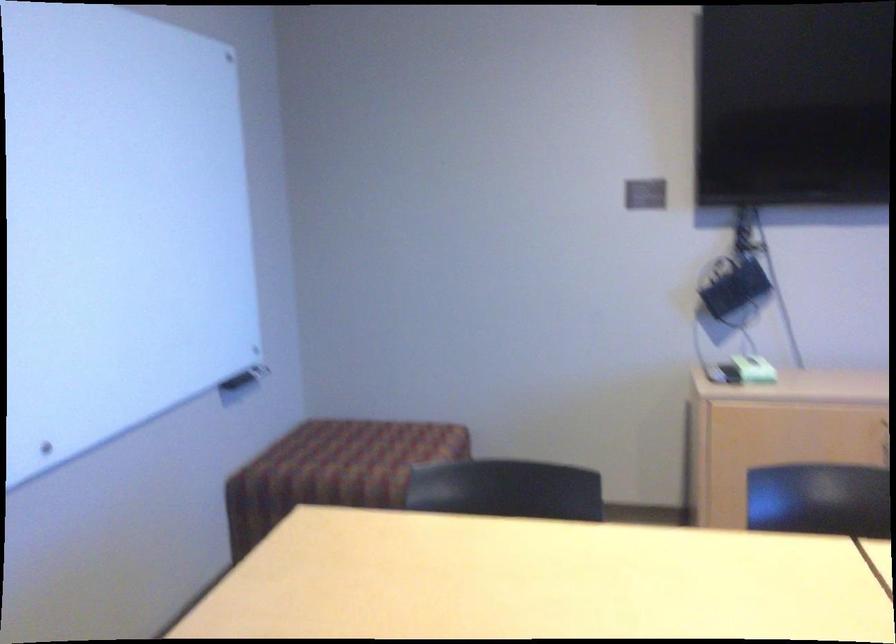
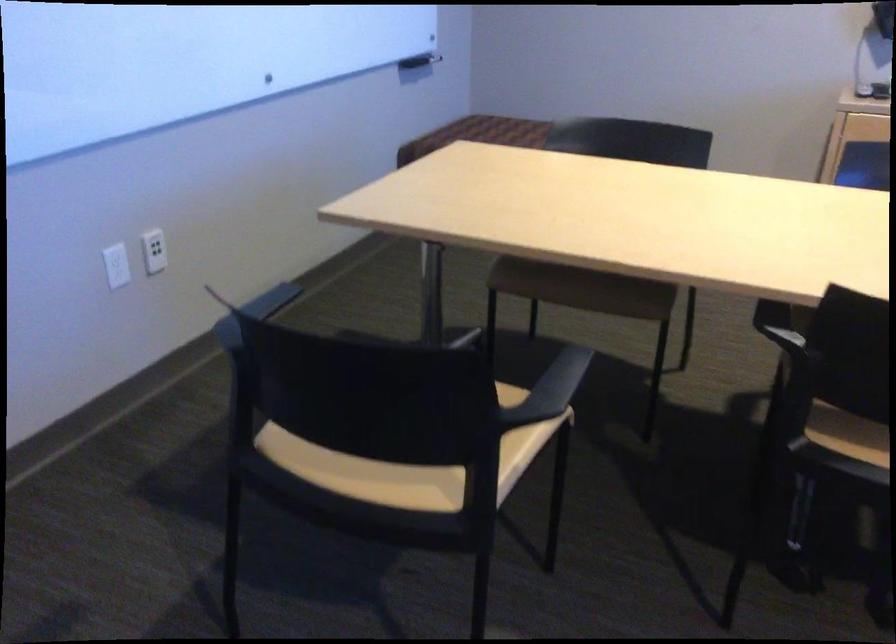
Question: The images are taken continuously from a first-person perspective. In which direction is your viewpoint rotating?

Choices:
 (A) Left
 (B) Right
 (C) Up
 (D) Down

Answer: (D)